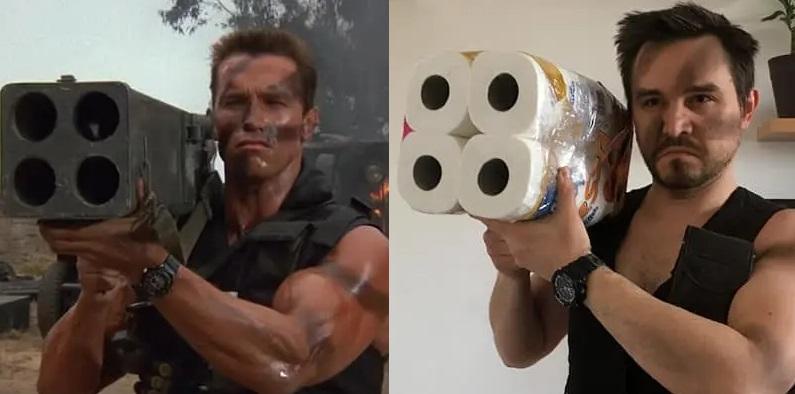
I want to click on wall, so click(x=524, y=19).